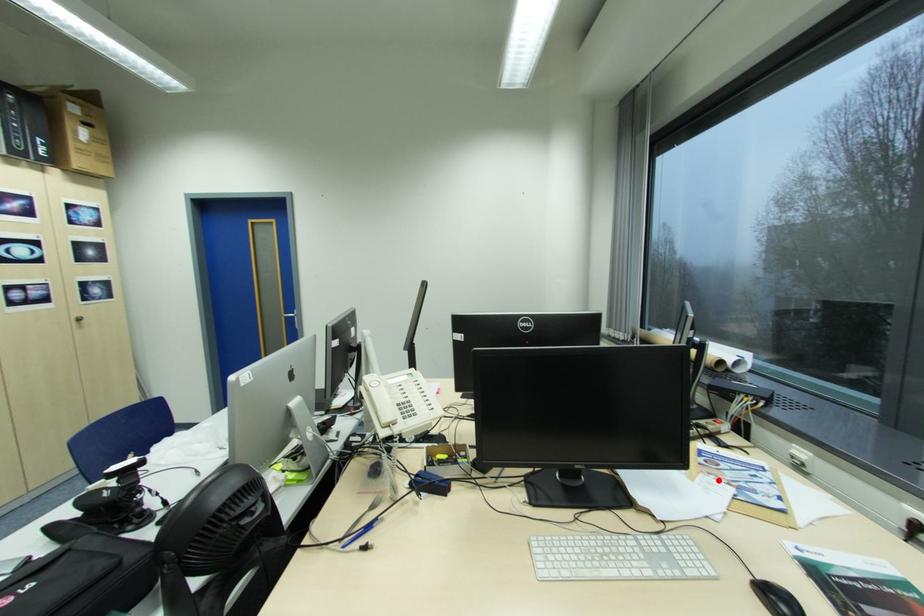
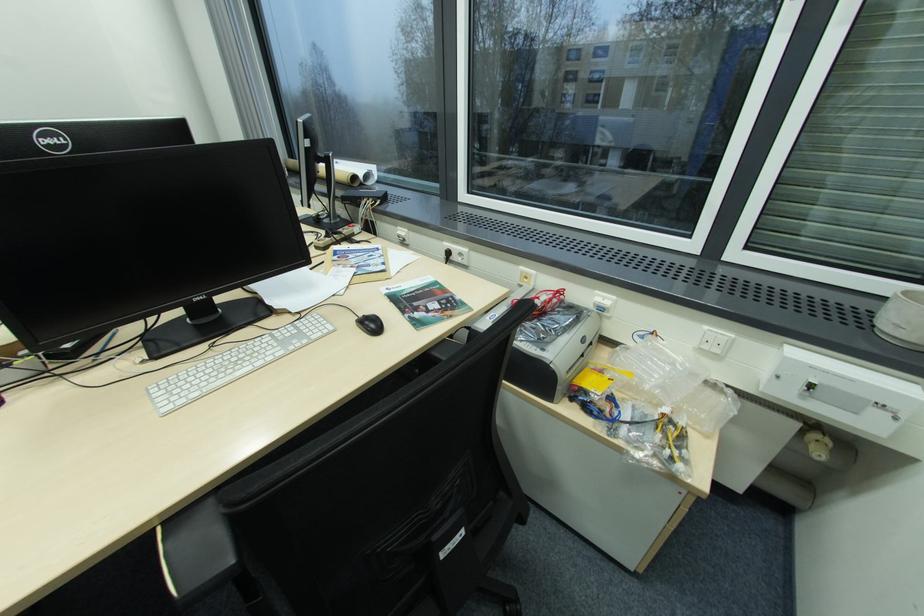
In the second image, find the point that corresponds to the highlighted location in the first image.

(346, 270)